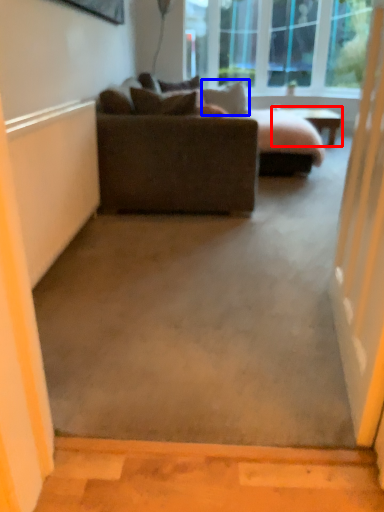
Question: Which point is further to the camera, table (highlighted by a red box) or pillow (highlighted by a blue box)?

Choices:
 (A) table
 (B) pillow

Answer: (A)